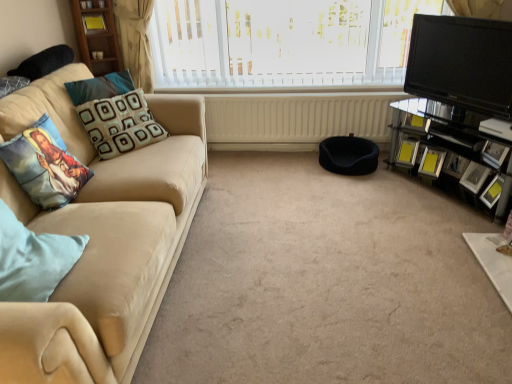
Where is `free space that is in between black glossy entertainment center at right and white glossy table at lower right`? The height and width of the screenshot is (384, 512). free space that is in between black glossy entertainment center at right and white glossy table at lower right is located at coordinates (439, 212).